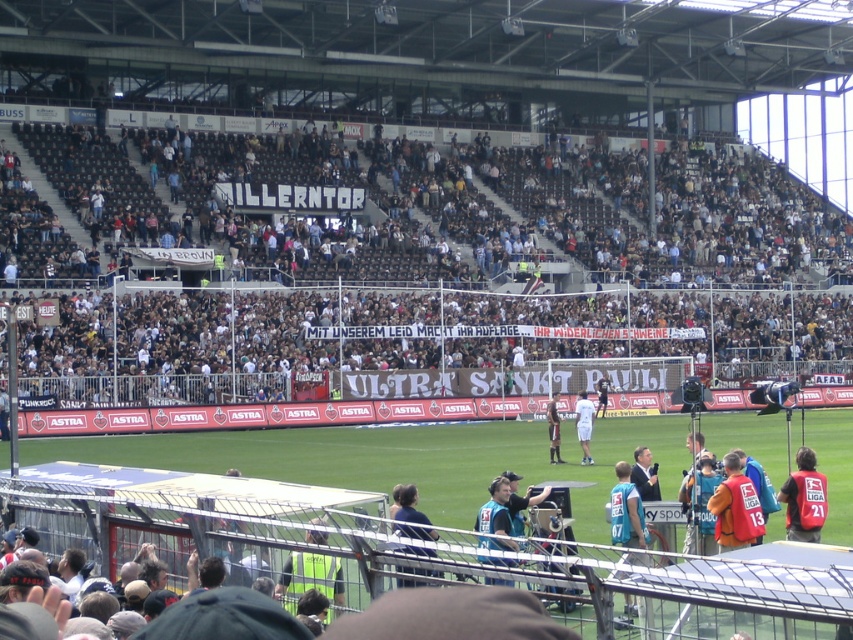
You are a GUI agent. You are given a task and a screenshot of the screen. Output one action in this format:
    pyautogui.click(x=<x>, y=<y>)
    Task: Click on the orange jersey at right
    The image size is (853, 640).
    Given the screenshot: What is the action you would take?
    pyautogui.click(x=735, y=508)

Between point (744, 496) and point (424, 522), which one is positioned in front?

Positioned in front is point (424, 522).

At what (x,y) coordinates should I click in order to perform the action: click on orange jersey at right. Please return your answer as a coordinate pair (x, y). The width and height of the screenshot is (853, 640). Looking at the image, I should click on (735, 508).

Measure the distance between red fabric vest at lower right and white fabric shirt at center.

A distance of 22.66 meters exists between red fabric vest at lower right and white fabric shirt at center.

Is red fabric vest at lower right above white fabric shirt at center?

Correct, red fabric vest at lower right is located above white fabric shirt at center.

Identify the location of red fabric vest at lower right. (804, 499).

Does dark blue shirt at center appear under dark brown leather jacket at center?

No, dark blue shirt at center is not below dark brown leather jacket at center.

Which is behind, point (408, 506) or point (550, 449)?

The point (550, 449) is behind.

Locate an element on the screen. dark blue shirt at center is located at coordinates [x=408, y=506].